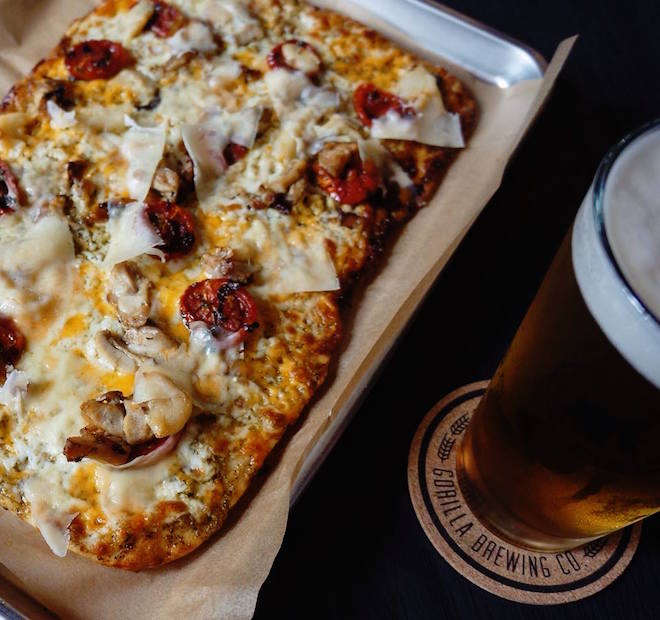
At what (x,y) coordinates should I click in order to perform the action: click on coaster. Please return your answer as a coordinate pair (x, y). The width and height of the screenshot is (660, 620). Looking at the image, I should click on (471, 541).